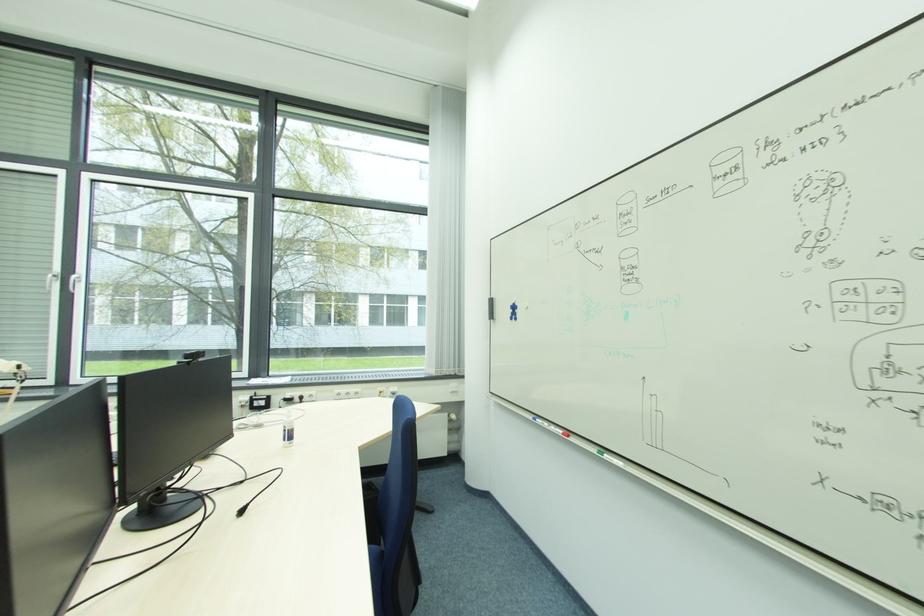
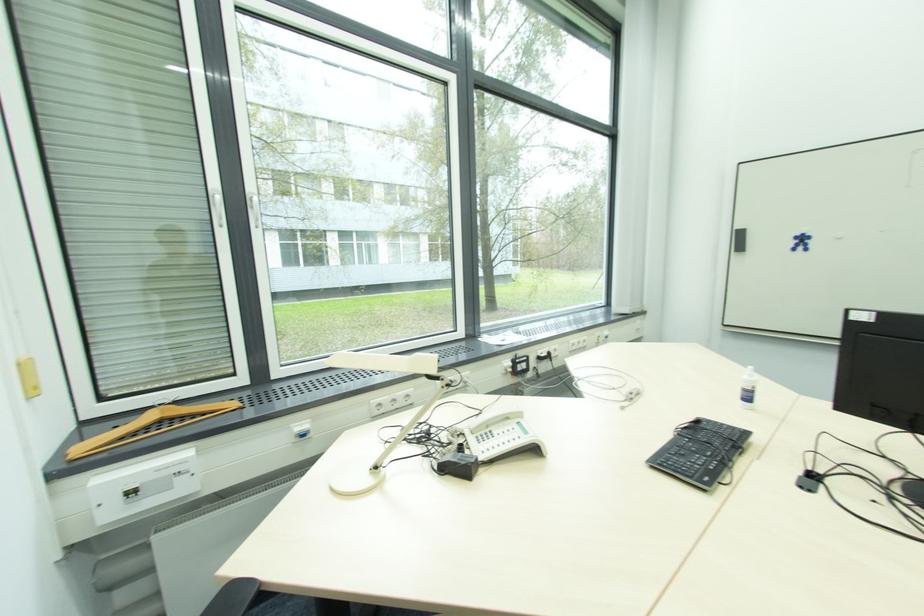
Question: I am providing you with two images of the same scene from different viewpoints. After the viewpoint changes to image2, which objects are now occluded?

Choices:
 (A) black whiteboard eraser
 (B) white window handle
 (C) black keyhole
 (D) blue whiteboard marker

Answer: (D)